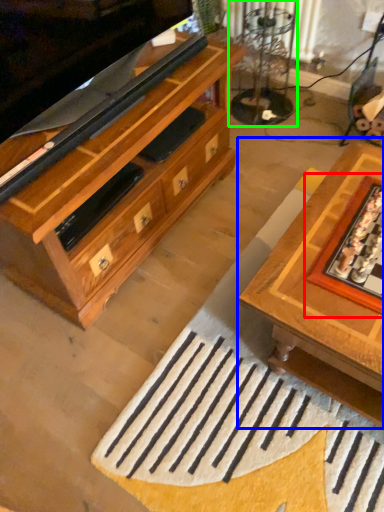
Question: Which object is the farthest from board game (highlighted by a red box)? Choose among these: table (highlighted by a blue box) or glass table (highlighted by a green box).

Choices:
 (A) table
 (B) glass table

Answer: (B)